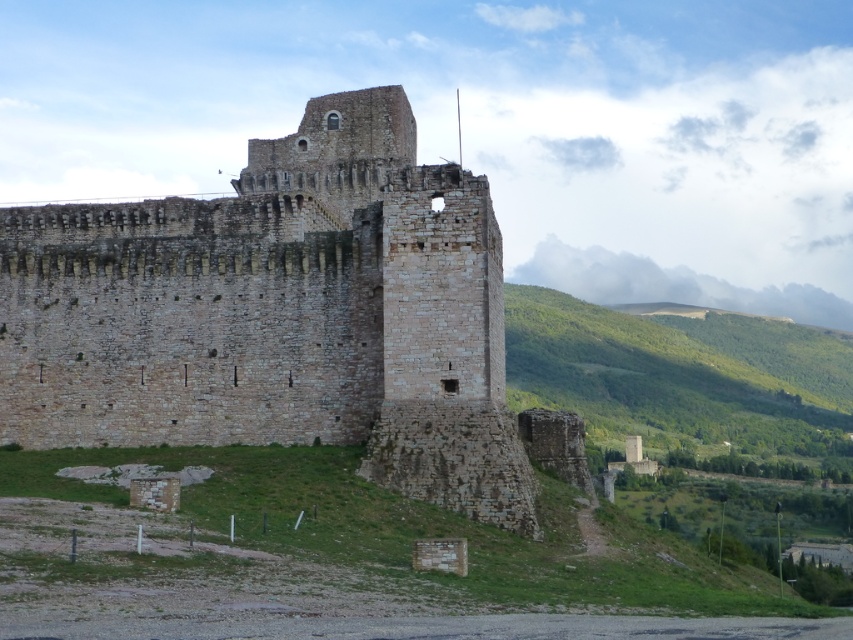
Question: Which point is farther to the camera?

Choices:
 (A) (689, 422)
 (B) (381, 291)

Answer: (A)

Question: Observing the image, what is the correct spatial positioning of brown stone castle at center in reference to green leafy hillside at right?

Choices:
 (A) below
 (B) above

Answer: (B)

Question: Is the position of brown stone castle at center less distant than that of green leafy hillside at right?

Choices:
 (A) yes
 (B) no

Answer: (A)

Question: Is brown stone castle at center bigger than green leafy hillside at right?

Choices:
 (A) no
 (B) yes

Answer: (A)

Question: Among these points, which one is farthest from the camera?

Choices:
 (A) (340, 145)
 (B) (540, 362)

Answer: (B)